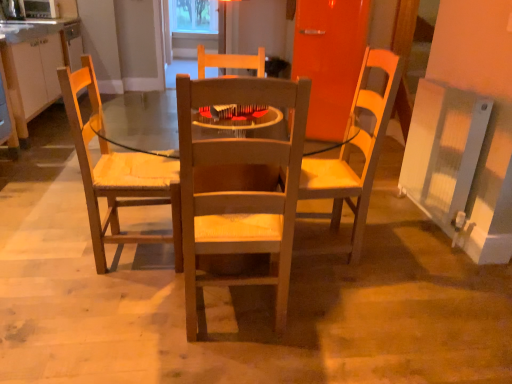
Question: Would you say matte white cabinets at left is part of wooden chair at left's contents?

Choices:
 (A) no
 (B) yes

Answer: (A)

Question: Is wooden chair at left behind matte white cabinets at left?

Choices:
 (A) no
 (B) yes

Answer: (A)

Question: Considering the relative sizes of wooden chair at left and matte white cabinets at left in the image provided, is wooden chair at left smaller than matte white cabinets at left?

Choices:
 (A) yes
 (B) no

Answer: (A)

Question: Would you say wooden chair at left is a long distance from matte white cabinets at left?

Choices:
 (A) no
 (B) yes

Answer: (B)

Question: Would you say wooden chair at left is outside matte white cabinets at left?

Choices:
 (A) no
 (B) yes

Answer: (B)

Question: Is wooden chair at left wider than matte white cabinets at left?

Choices:
 (A) no
 (B) yes

Answer: (A)

Question: Considering the relative sizes of wooden chair at center and metallic silver microwave oven at upper left in the image provided, is wooden chair at center smaller than metallic silver microwave oven at upper left?

Choices:
 (A) no
 (B) yes

Answer: (A)

Question: From the image's perspective, does wooden chair at center appear lower than metallic silver microwave oven at upper left?

Choices:
 (A) no
 (B) yes

Answer: (B)

Question: Is wooden chair at center facing towards metallic silver microwave oven at upper left?

Choices:
 (A) yes
 (B) no

Answer: (B)

Question: Is the position of wooden chair at center more distant than that of metallic silver microwave oven at upper left?

Choices:
 (A) yes
 (B) no

Answer: (B)

Question: Is wooden chair at center at the left side of metallic silver microwave oven at upper left?

Choices:
 (A) yes
 (B) no

Answer: (B)

Question: Does wooden chair at center contain metallic silver microwave oven at upper left?

Choices:
 (A) no
 (B) yes

Answer: (A)

Question: Is transparent plastic window screen at upper center completely or partially outside of metallic silver microwave oven at upper left?

Choices:
 (A) yes
 (B) no

Answer: (A)